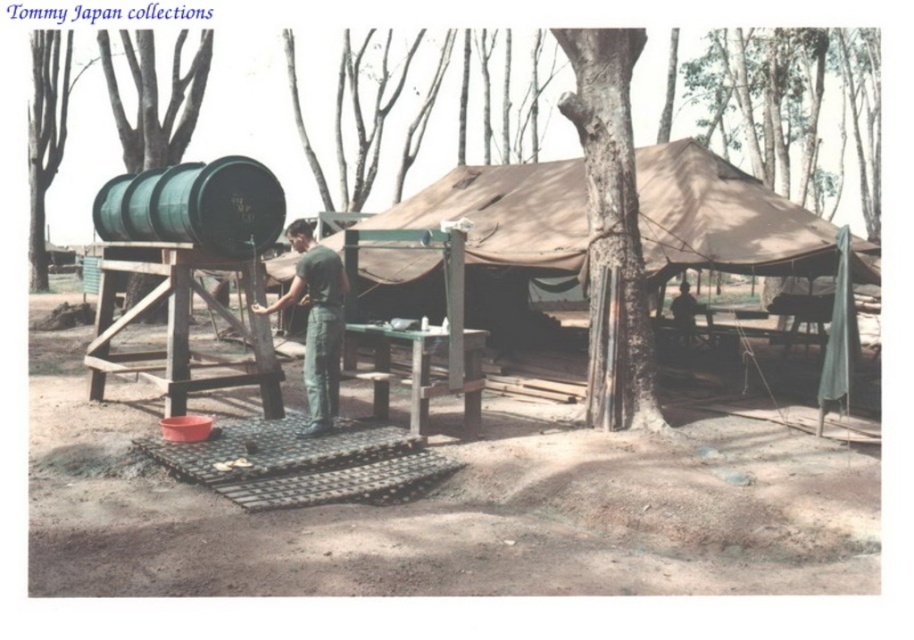
You are setting up a campsite and need to place a tent between the green matte barrel at left and the green bark tree at left. According to the scene description, which object should you position the tent closer to if you want it to be on the right side of both objects?

The green matte barrel at left is positioned to the right of the green bark tree at left. To place the tent on the right side of both objects, position it closer to the green matte barrel at left.

You are a hiker who needs to determine which item is larger in size between the green bark tree at left and the dark green uniform at center. Based on the scene, which one is bigger?

The green bark tree at left is bigger than the dark green uniform at center.

You are a hiker who needs to decide whether to use the green bark tree at left or the dark green uniform at center to hang your gear. Considering their widths, which object would provide a more stable base for hanging items?

The green bark tree at left is wider than the dark green uniform at center, so it would provide a more stable base for hanging items.